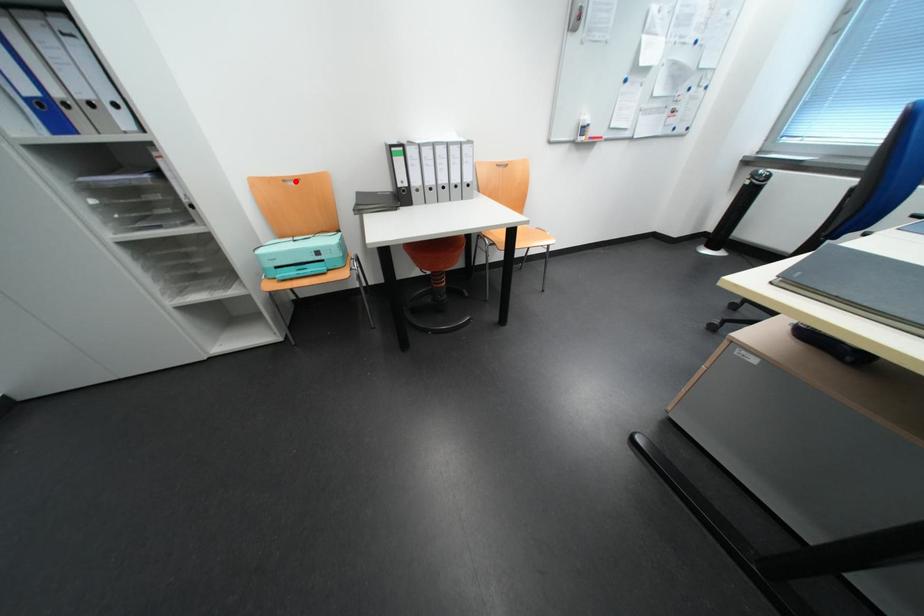
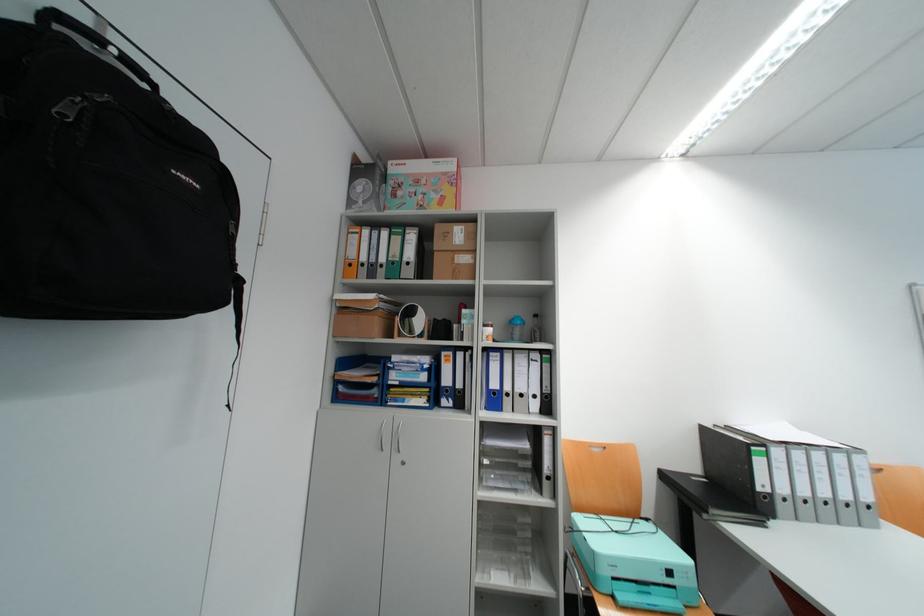
The point at the highlighted location is marked in the first image. Where is the corresponding point in the second image?

(602, 447)